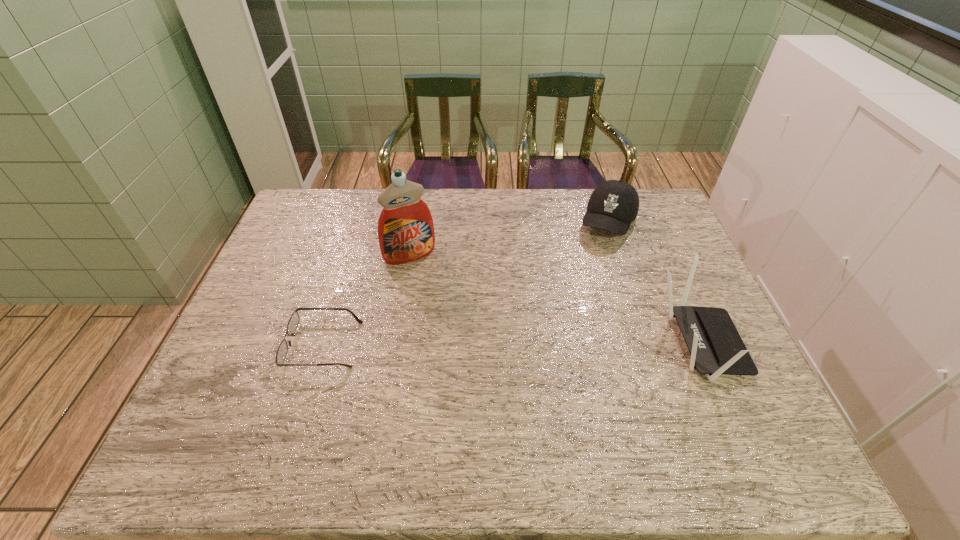
At what (x,y) coordinates should I click in order to perform the action: click on vacant space located 0.390m on the front-facing side of the second shortest object. Please return your answer as a coordinate pair (x, y). Image resolution: width=960 pixels, height=540 pixels. Looking at the image, I should click on (563, 331).

Locate an element on the screen. The width and height of the screenshot is (960, 540). free spot located on the front surface of the second object from left to right is located at coordinates (464, 341).

At what (x,y) coordinates should I click in order to perform the action: click on blank space located 0.210m on the front surface of the second object from left to right. Please return your answer as a coordinate pair (x, y). The height and width of the screenshot is (540, 960). Looking at the image, I should click on (447, 312).

The height and width of the screenshot is (540, 960). What are the coordinates of `free space located on the front surface of the second object from left to right` in the screenshot? It's located at (468, 350).

Locate an element on the screen. This screenshot has height=540, width=960. object at the far edge is located at coordinates (613, 205).

Where is `object that is at the near edge`? Image resolution: width=960 pixels, height=540 pixels. object that is at the near edge is located at coordinates click(716, 347).

Locate an element on the screen. object that is positioned at the left edge is located at coordinates (293, 322).

Locate an element on the screen. The image size is (960, 540). router positioned at the right edge is located at coordinates (716, 347).

Find the location of a particular element. baseball cap that is at the right edge is located at coordinates (613, 205).

At what (x,y) coordinates should I click in order to perform the action: click on object present at the far right corner. Please return your answer as a coordinate pair (x, y). Looking at the image, I should click on (613, 205).